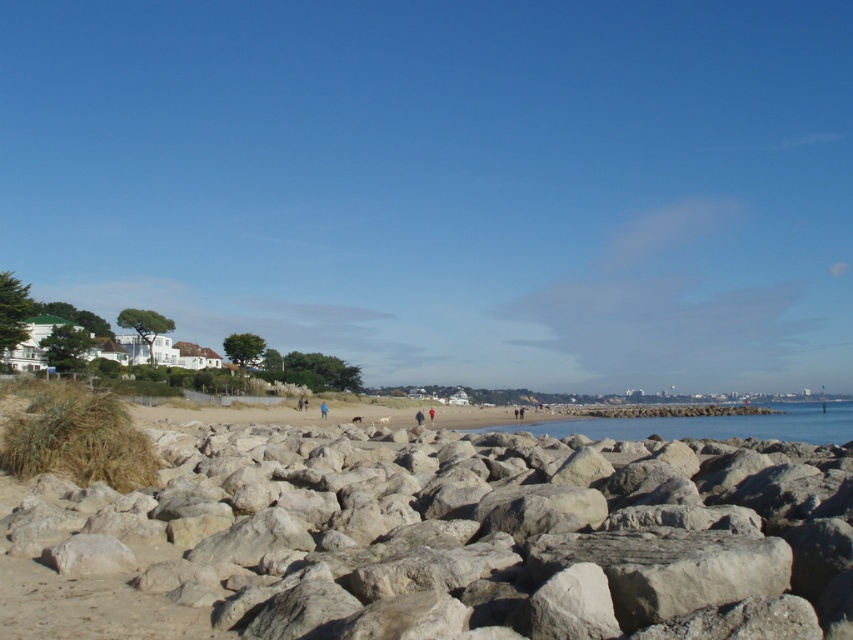
Question: Among these objects, which one is farthest from the camera?

Choices:
 (A) clear blue water at center
 (B) blue fabric person at center
 (C) smooth gray rocks at center

Answer: (B)

Question: Can you confirm if clear blue water at center is wider than blue fabric person at center?

Choices:
 (A) no
 (B) yes

Answer: (B)

Question: Considering the real-world distances, which object is closest to the smooth gray rocks at center?

Choices:
 (A) clear blue water at center
 (B) blue fabric person at center

Answer: (B)

Question: Does clear blue water at center lie in front of blue fabric person at center?

Choices:
 (A) yes
 (B) no

Answer: (A)

Question: Is clear blue water at center smaller than blue fabric person at center?

Choices:
 (A) yes
 (B) no

Answer: (B)

Question: Which of the following is the closest to the observer?

Choices:
 (A) smooth gray rocks at center
 (B) clear blue water at center

Answer: (A)